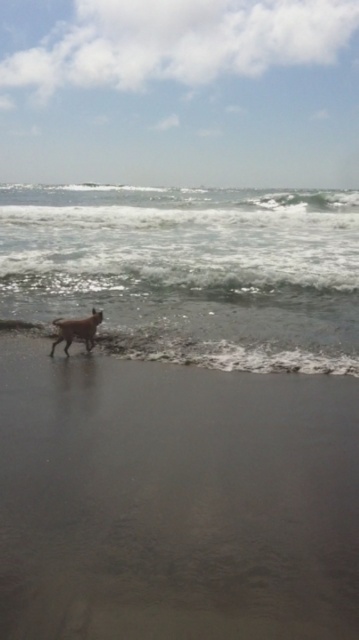
Is brown sand at lower left closer to camera compared to brown fur dog at center?

Yes, it is.

Is point (274, 515) behind point (90, 339)?

No.

What are the coordinates of `brown sand at lower left` in the screenshot? It's located at (174, 500).

Can you confirm if clear water at lower left is smaller than brown fur dog at center?

Incorrect, clear water at lower left is not smaller in size than brown fur dog at center.

Is clear water at lower left to the right of brown fur dog at center from the viewer's perspective?

No, clear water at lower left is not to the right of brown fur dog at center.

Who is more forward, (333, 234) or (98, 321)?

Point (98, 321) is in front.

I want to click on clear water at lower left, so click(190, 272).

Consider the image. Who is taller, brown sand at lower left or clear water at lower left?

With more height is clear water at lower left.

Is point (25, 403) more distant than point (118, 289)?

No, it is in front of (118, 289).

Does point (151, 380) come behind point (323, 312)?

No.

The height and width of the screenshot is (640, 359). I want to click on brown sand at lower left, so pos(174,500).